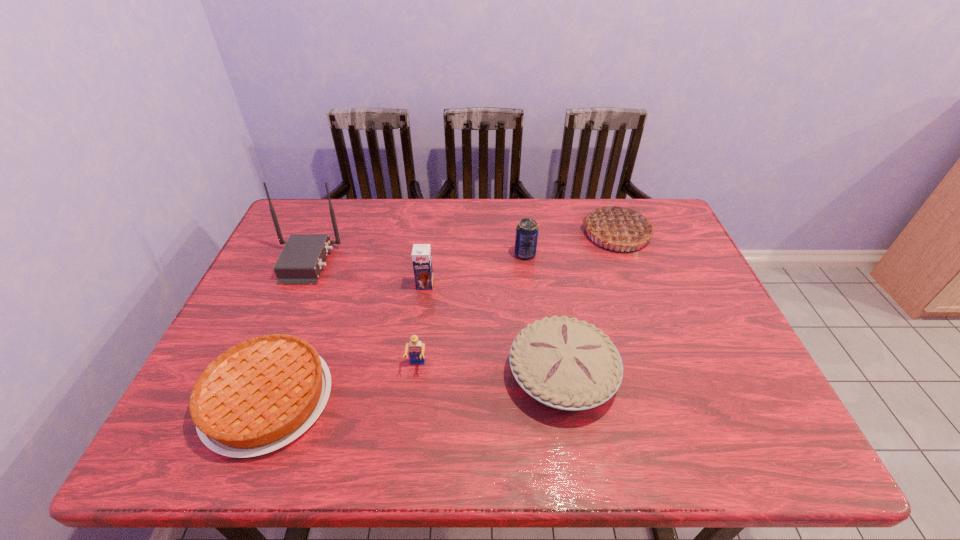
Select which pie appears as the second closest to the tallest object. Please provide its 2D coordinates. Your answer should be formatted as a tuple, i.e. [(x, y)], where the tuple contains the x and y coordinates of a point satisfying the conditions above.

[(566, 364)]

Where is `free location that satisfies the following two spatial constraints: 1. on the back side of the second pie from left to right; 2. on the back of the router to connect cables`? This screenshot has height=540, width=960. free location that satisfies the following two spatial constraints: 1. on the back side of the second pie from left to right; 2. on the back of the router to connect cables is located at coordinates (544, 262).

Where is `free spot that satisfies the following two spatial constraints: 1. on the back of the second shortest pie to connect cables; 2. on the right side of the tallest object`? This screenshot has height=540, width=960. free spot that satisfies the following two spatial constraints: 1. on the back of the second shortest pie to connect cables; 2. on the right side of the tallest object is located at coordinates (257, 374).

Image resolution: width=960 pixels, height=540 pixels. I want to click on vacant space that satisfies the following two spatial constraints: 1. on the back of the second shortest pie to connect cables; 2. on the left side of the router, so click(257, 374).

This screenshot has height=540, width=960. I want to click on blank area in the image that satisfies the following two spatial constraints: 1. on the back of the router to connect cables; 2. on the right side of the leftmost pie, so click(x=246, y=399).

You are a GUI agent. You are given a task and a screenshot of the screen. Output one action in this format:
    pyautogui.click(x=<x>, y=<y>)
    Task: Click on the vacant space that satisfies the following two spatial constraints: 1. on the front side of the fourth shortest object; 2. on the back of the router to connect cables
    
    Given the screenshot: What is the action you would take?
    pyautogui.click(x=526, y=262)

This screenshot has height=540, width=960. Find the location of `free spot that satisfies the following two spatial constraints: 1. on the back of the tallest object to connect cables; 2. on the back side of the shortest object`. free spot that satisfies the following two spatial constraints: 1. on the back of the tallest object to connect cables; 2. on the back side of the shortest object is located at coordinates (246, 399).

Where is `vacant region that satisfies the following two spatial constraints: 1. on the back of the shortest pie to connect cables; 2. on the left side of the tallest object`? This screenshot has height=540, width=960. vacant region that satisfies the following two spatial constraints: 1. on the back of the shortest pie to connect cables; 2. on the left side of the tallest object is located at coordinates (246, 399).